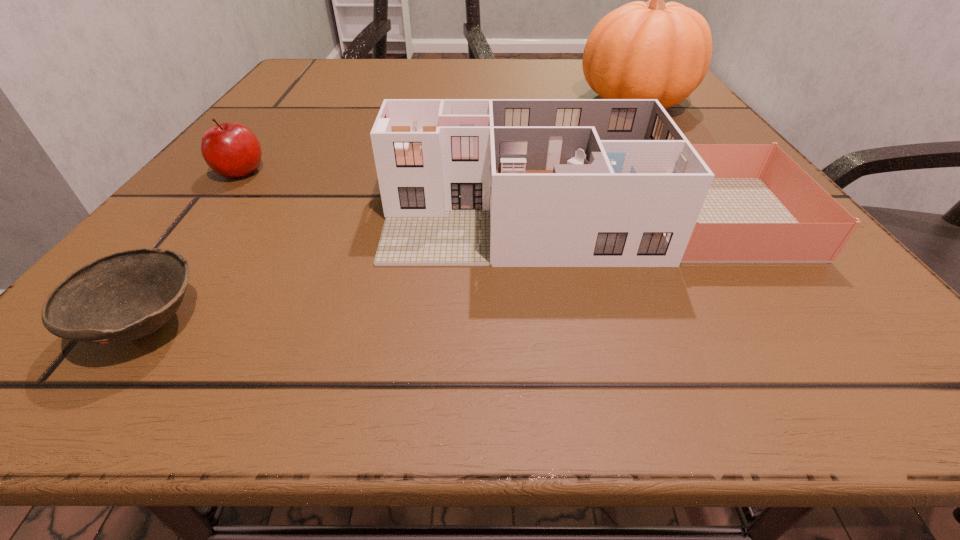
Locate an element on the screen. This screenshot has height=540, width=960. the tallest object is located at coordinates (642, 50).

Locate an element on the screen. The image size is (960, 540). pumpkin is located at coordinates (642, 50).

Image resolution: width=960 pixels, height=540 pixels. Find the location of `the second tallest object`. the second tallest object is located at coordinates (464, 182).

Where is `apple`? The image size is (960, 540). apple is located at coordinates (230, 149).

Find the location of a particular element. The width and height of the screenshot is (960, 540). the nearest object is located at coordinates (124, 296).

Where is `bowl`? This screenshot has height=540, width=960. bowl is located at coordinates (124, 296).

Find the location of a particular element. free space located 0.050m on the back of the pumpkin is located at coordinates (616, 73).

Where is `vacant space positioned at the entrance of the third shortest object`? The height and width of the screenshot is (540, 960). vacant space positioned at the entrance of the third shortest object is located at coordinates (348, 218).

The width and height of the screenshot is (960, 540). What are the coordinates of `vacant region located 0.220m at the entrance of the third shortest object` in the screenshot? It's located at (223, 218).

You are a GUI agent. You are given a task and a screenshot of the screen. Output one action in this format:
    pyautogui.click(x=<x>, y=<y>)
    Task: Click on the free spot located 0.110m at the entrance of the third shortest object
    
    Given the screenshot: What is the action you would take?
    pyautogui.click(x=304, y=218)